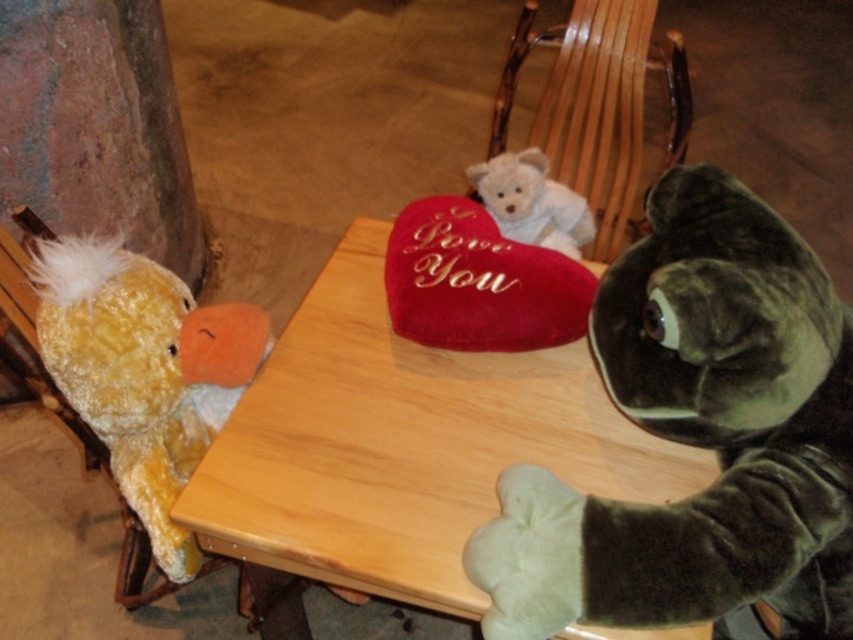
You are a guest in this cozy room and want to sit down in the wooden rocking chair at center without disturbing the fuzzy yellow duck at left. Is there enough space between them for you to move past?

The fuzzy yellow duck at left is positioned on the left side of wooden rocking chair at center, so there is sufficient space between them for you to move past without disturbing the duck.

You are a photographer trying to capture a closeup of the fuzzy yellow duck at left and the wooden rocking chair at center. Which object should you focus on first to ensure it appears sharp in your photo?

You should focus on the fuzzy yellow duck at left first because it is closer to the viewer than the wooden rocking chair at center, so adjusting focus from near to far will help capture both objects clearly.

You are a waiter in a whimsical indoor setting. You need to place a small vase exactly at the point with coordinates point (x=404, y=444) on the wooden table at center. Where should you place the vase?

Place the vase at point (x=404, y=444) on the wooden table at center.